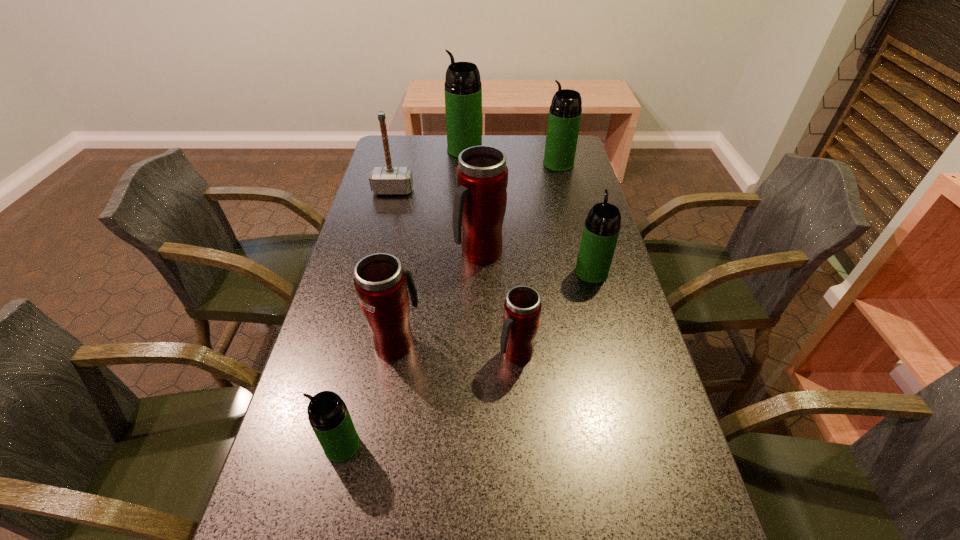
This screenshot has height=540, width=960. In the image, there is a desktop. In order to click on vacant space at the left edge in this screenshot , I will do point(368,356).

Identify the location of blank space at the right edge of the desktop. coord(602,292).

Identify the location of vacant point located between the biggest green thermos bottle and the third smallest green thermos bottle. The width and height of the screenshot is (960, 540). (512, 157).

Find the location of `free area in between the second biggest green thermos bottle and the nearest green thermos bottle`. free area in between the second biggest green thermos bottle and the nearest green thermos bottle is located at coordinates (450, 305).

This screenshot has width=960, height=540. In order to click on empty space between the second biggest green thermos bottle and the smallest red thermos bottle in this screenshot , I will do `click(538, 259)`.

Identify the location of vacant area between the smallest red thermos bottle and the brown hammer. The image size is (960, 540). (455, 272).

At what (x,y) coordinates should I click in order to perform the action: click on free area in between the second biggest green thermos bottle and the smallest red thermos bottle. Please return your answer as a coordinate pair (x, y). The image size is (960, 540). Looking at the image, I should click on (538, 259).

What are the coordinates of `free space between the biggest green thermos bottle and the third farthest object` in the screenshot? It's located at (429, 171).

Locate an element on the screen. This screenshot has height=540, width=960. empty space between the smallest red thermos bottle and the second biggest green thermos bottle is located at coordinates (538, 259).

Where is `free space between the second smallest red thermos bottle and the smallest red thermos bottle`? The width and height of the screenshot is (960, 540). free space between the second smallest red thermos bottle and the smallest red thermos bottle is located at coordinates click(456, 348).